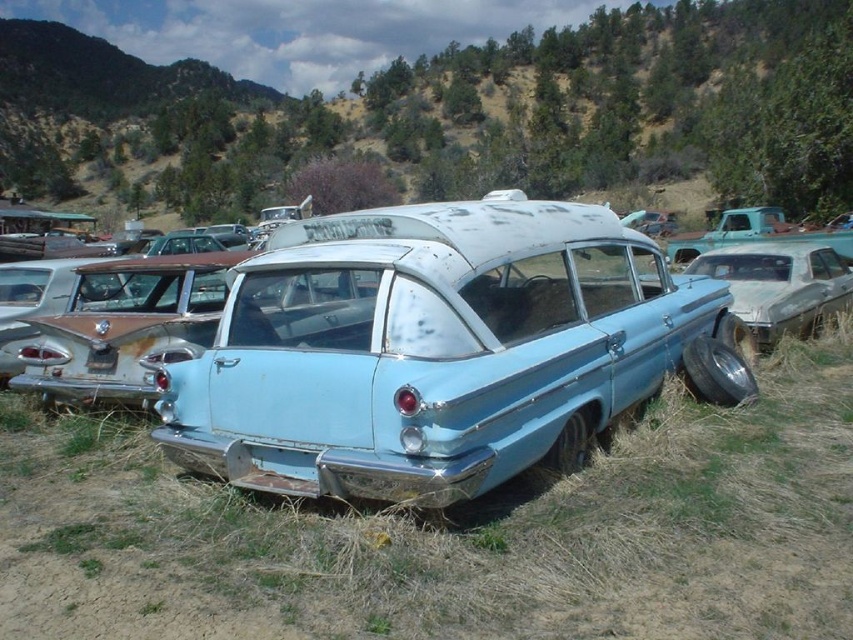
Is the position of rusty metal station wagon at center more distant than that of teal matte truck at right?

No.

Does rusty metal station wagon at center appear under teal matte truck at right?

Correct, rusty metal station wagon at center is located below teal matte truck at right.

Image resolution: width=853 pixels, height=640 pixels. What do you see at coordinates (126, 326) in the screenshot?
I see `rusty metal station wagon at center` at bounding box center [126, 326].

Where is `rusty metal station wagon at center`? rusty metal station wagon at center is located at coordinates (126, 326).

Can you confirm if green grassy hillside at upper center is positioned above rusty metal station wagon at center?

Yes.

Does green grassy hillside at upper center have a larger size compared to rusty metal station wagon at center?

Indeed, green grassy hillside at upper center has a larger size compared to rusty metal station wagon at center.

This screenshot has height=640, width=853. What do you see at coordinates (456, 113) in the screenshot? I see `green grassy hillside at upper center` at bounding box center [456, 113].

Find the location of a particular element. green grassy hillside at upper center is located at coordinates (456, 113).

This screenshot has width=853, height=640. In order to click on light blue metallic station wagon at center in this screenshot , I will do `click(431, 349)`.

Is point (566, 385) positioned in front of point (782, 328)?

That is True.

Who is more forward, (467, 336) or (756, 308)?

Point (467, 336) is in front.

The image size is (853, 640). I want to click on light blue metallic station wagon at center, so click(431, 349).